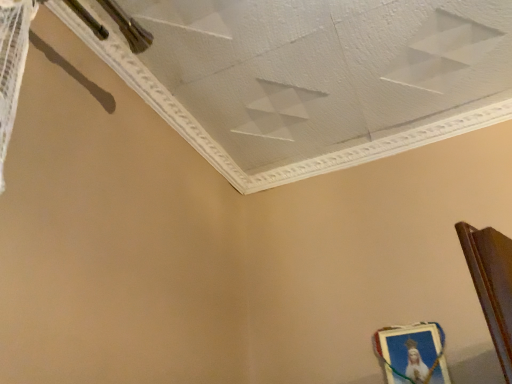
Locate an element on the screen. This screenshot has width=512, height=384. metallic gold picture frame at lower right is located at coordinates (412, 354).

What do you see at coordinates (412, 354) in the screenshot? The image size is (512, 384). I see `metallic gold picture frame at lower right` at bounding box center [412, 354].

What do you see at coordinates (313, 78) in the screenshot?
I see `white textured ceiling at upper center` at bounding box center [313, 78].

Identify the location of white textured ceiling at upper center. [313, 78].

You are a GUI agent. You are given a task and a screenshot of the screen. Output one action in this format:
    pyautogui.click(x=<x>, y=<y>)
    Task: Click on the metallic gold picture frame at lower right
    The width and height of the screenshot is (512, 384).
    Given the screenshot: What is the action you would take?
    pyautogui.click(x=412, y=354)

Does metallic gold picture frame at lower right appear on the right side of white textured ceiling at upper center?

Indeed, metallic gold picture frame at lower right is positioned on the right side of white textured ceiling at upper center.

In the scene shown: Which object is closer to the camera, metallic gold picture frame at lower right or white textured ceiling at upper center?

Positioned in front is white textured ceiling at upper center.

Looking at this image, which is nearer, (399,377) or (264,68)?

Positioned in front is point (264,68).

From the image's perspective, which is below, metallic gold picture frame at lower right or white textured ceiling at upper center?

A: metallic gold picture frame at lower right appears lower in the image.

From a real-world perspective, is metallic gold picture frame at lower right above or below white textured ceiling at upper center?

In terms of real-world spatial position, metallic gold picture frame at lower right is below white textured ceiling at upper center.

Considering the relative sizes of metallic gold picture frame at lower right and white textured ceiling at upper center in the image provided, is metallic gold picture frame at lower right thinner than white textured ceiling at upper center?

Correct, the width of metallic gold picture frame at lower right is less than that of white textured ceiling at upper center.

In terms of height, does metallic gold picture frame at lower right look taller or shorter compared to white textured ceiling at upper center?

Considering their sizes, metallic gold picture frame at lower right has more height than white textured ceiling at upper center.

Between metallic gold picture frame at lower right and white textured ceiling at upper center, which one has smaller size?

Smaller between the two is metallic gold picture frame at lower right.

Can we say metallic gold picture frame at lower right lies outside white textured ceiling at upper center?

Absolutely, metallic gold picture frame at lower right is external to white textured ceiling at upper center.

Is metallic gold picture frame at lower right with white textured ceiling at upper center?

No, metallic gold picture frame at lower right is not in contact with white textured ceiling at upper center.

Is metallic gold picture frame at lower right turned away from white textured ceiling at upper center?

metallic gold picture frame at lower right is not turned away from white textured ceiling at upper center.

How many degrees apart are the facing directions of metallic gold picture frame at lower right and white textured ceiling at upper center?

The angle between the facing direction of metallic gold picture frame at lower right and the facing direction of white textured ceiling at upper center is 180 degrees.

How distant is metallic gold picture frame at lower right from white textured ceiling at upper center?

metallic gold picture frame at lower right and white textured ceiling at upper center are 30.73 inches apart.

Where is `picture frame behind the white textured ceiling at upper center`? picture frame behind the white textured ceiling at upper center is located at coordinates (412, 354).

Can you confirm if white textured ceiling at upper center is positioned to the right of metallic gold picture frame at lower right?

In fact, white textured ceiling at upper center is to the left of metallic gold picture frame at lower right.

In the image, is white textured ceiling at upper center positioned in front of or behind metallic gold picture frame at lower right?

Visually, white textured ceiling at upper center is located in front of metallic gold picture frame at lower right.

Does point (234, 186) come behind point (414, 339)?

Yes, point (234, 186) is farther from viewer.

From the image's perspective, which object appears higher, white textured ceiling at upper center or metallic gold picture frame at lower right?

white textured ceiling at upper center, from the image's perspective.

From a real-world perspective, is white textured ceiling at upper center physically above metallic gold picture frame at lower right?

Yes.

Which object is thinner, white textured ceiling at upper center or metallic gold picture frame at lower right?

metallic gold picture frame at lower right is thinner.

Which of these two, white textured ceiling at upper center or metallic gold picture frame at lower right, stands shorter?

With less height is white textured ceiling at upper center.

Is white textured ceiling at upper center bigger than metallic gold picture frame at lower right?

Indeed, white textured ceiling at upper center has a larger size compared to metallic gold picture frame at lower right.

Would you say white textured ceiling at upper center is outside metallic gold picture frame at lower right?

white textured ceiling at upper center lies outside metallic gold picture frame at lower right's area.

Is white textured ceiling at upper center far away from metallic gold picture frame at lower right?

white textured ceiling at upper center is near metallic gold picture frame at lower right, not far away.

Is white textured ceiling at upper center oriented towards metallic gold picture frame at lower right?

No, white textured ceiling at upper center does not turn towards metallic gold picture frame at lower right.

Where is `wide that is on the left side of metallic gold picture frame at lower right`? Image resolution: width=512 pixels, height=384 pixels. wide that is on the left side of metallic gold picture frame at lower right is located at coordinates (313, 78).

Where is `wide in front of the metallic gold picture frame at lower right`? wide in front of the metallic gold picture frame at lower right is located at coordinates (313, 78).

At what (x,y) coordinates should I click in order to perform the action: click on wide that appears above the metallic gold picture frame at lower right (from a real-world perspective). Please return your answer as a coordinate pair (x, y). Looking at the image, I should click on (313, 78).